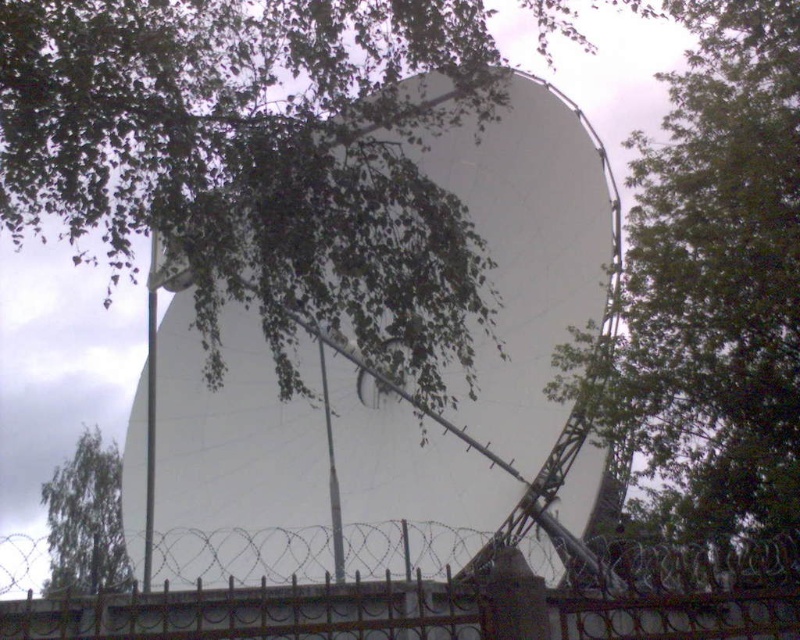
You are a maintenance worker needing to access the satellite dish. The black wrought iron fence at center and the green leafy tree at upper left are in your way. Which obstacle is shorter and easier to climb over?

The black wrought iron fence at center has a lesser height compared to the green leafy tree at upper left, so it is shorter and easier to climb over.

You are standing at the satellite dish and want to walk towards the barbed wire fence. Which point, point (586,257) or point (117,486), is closer to the fence?

Point (117,486) is closer to the barbed wire fence because it is behind point (586,257).

You are standing at the point closest to the satellite dish. Which of the two points, point (794, 225) or point (536, 614), is farther from your current position?

Point (794, 225) is farther from your current position because it is behind point (536, 614), which is closer to you.